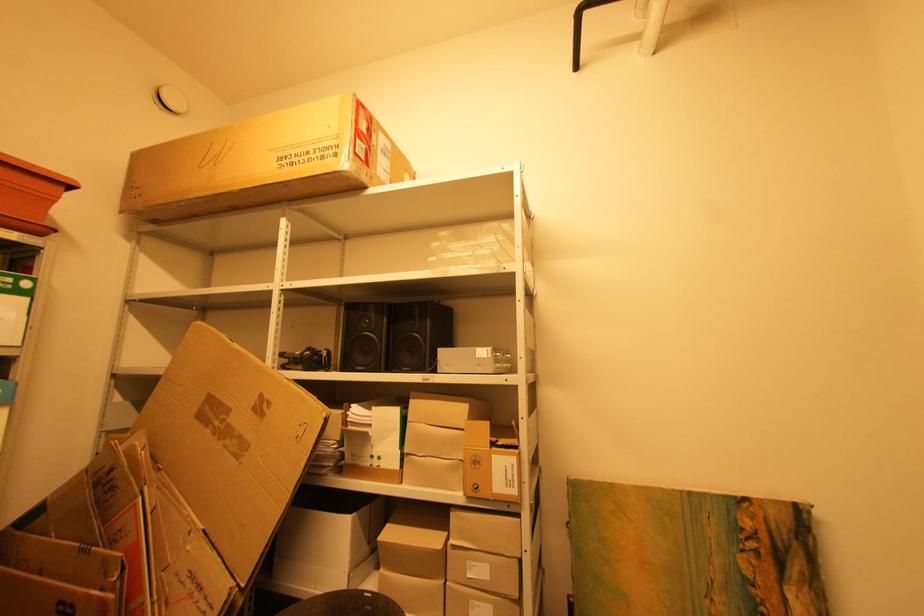
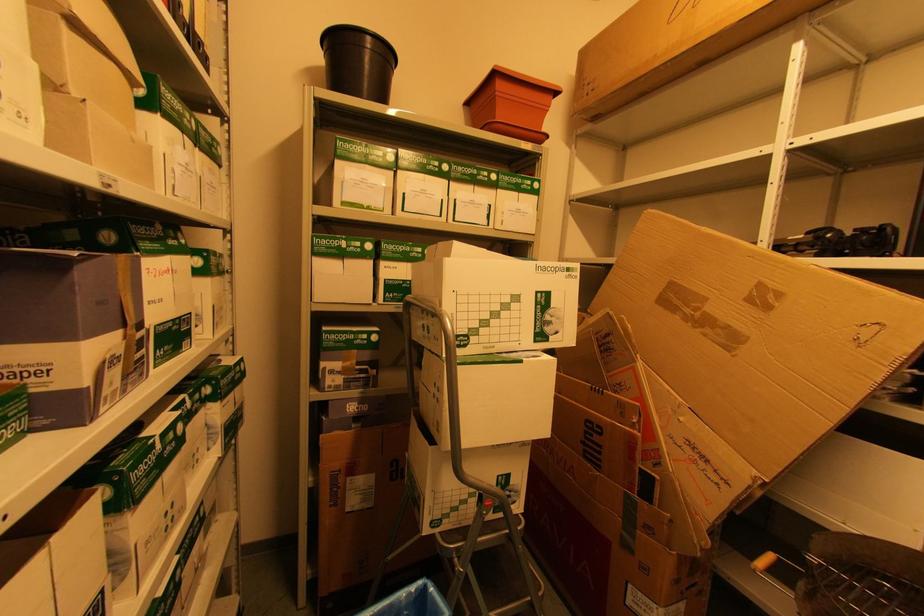
Question: Based on the continuous images, in which direction is the camera rotating? Reply with the corresponding letter.

Choices:
 (A) Left
 (B) Right
 (C) Up
 (D) Down

Answer: (A)